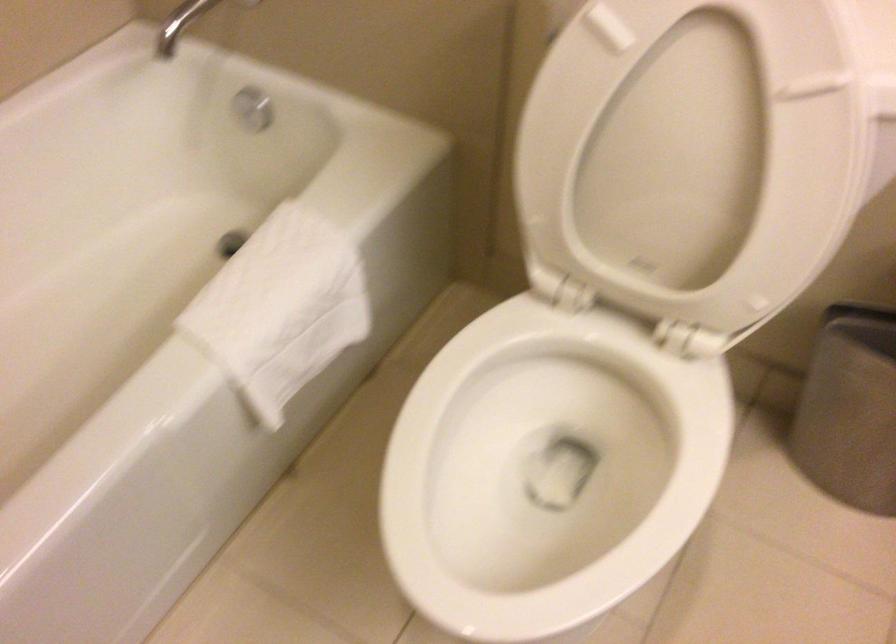
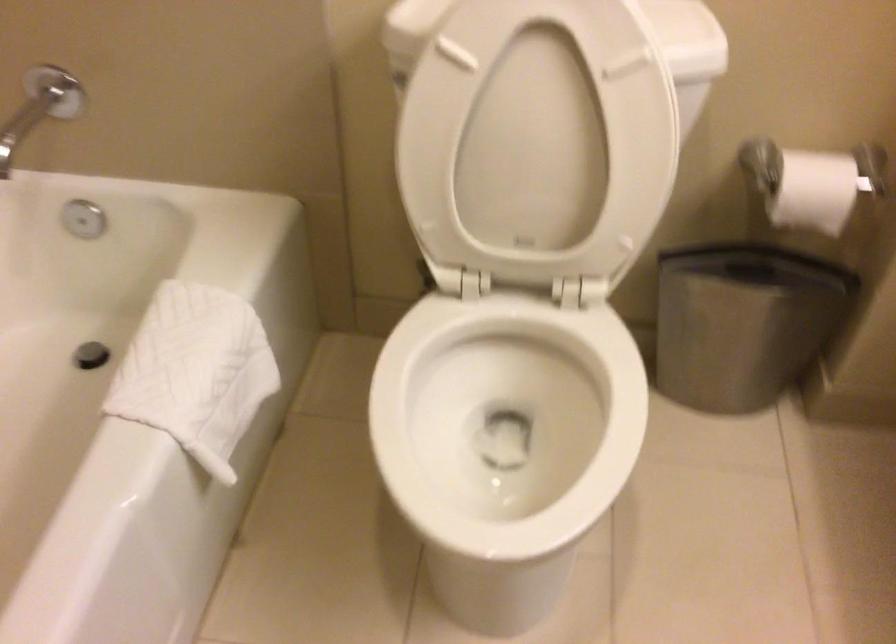
Question: The images are taken continuously from a first-person perspective. In which direction is your viewpoint rotating?

Choices:
 (A) Left
 (B) Right
 (C) Up
 (D) Down

Answer: (B)